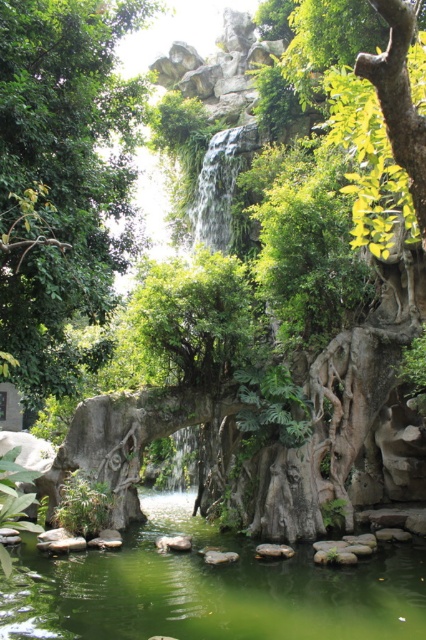
Question: Among these points, which one is farthest from the camera?

Choices:
 (A) (60, 268)
 (B) (115, 605)
 (C) (213, 168)

Answer: (C)

Question: Can you confirm if green liquid water at center is bigger than clear water at center?

Choices:
 (A) no
 (B) yes

Answer: (B)

Question: Which object appears closest to the camera in this image?

Choices:
 (A) green liquid water at center
 (B) green leafy tree at center

Answer: (B)

Question: Does green liquid water at center have a greater width compared to clear water at center?

Choices:
 (A) yes
 (B) no

Answer: (A)

Question: Does green liquid water at center have a smaller size compared to clear water at center?

Choices:
 (A) no
 (B) yes

Answer: (A)

Question: Which object is positioned closest to the clear water at center?

Choices:
 (A) green liquid water at center
 (B) green leafy tree at center

Answer: (B)